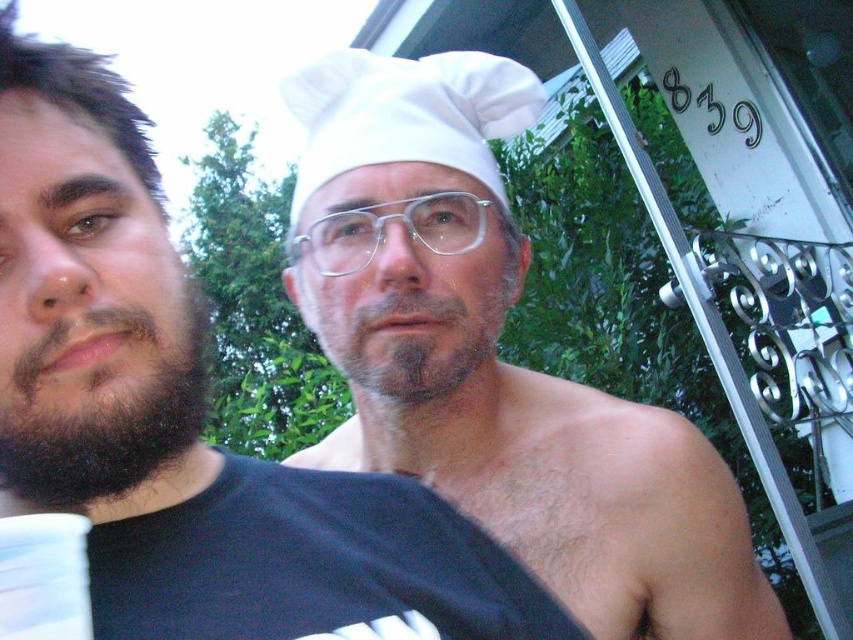
In the scene shown: You are a photographer trying to capture a closeup of the white matte chef hat at center and the white fabric chef hat at center. Which one will appear larger in your photo?

The white matte chef hat at center will appear larger in the photo because it is closer to the viewer than the white fabric chef hat at center.

You are a photographer trying to capture a portrait of both individuals in the scene. Since the white matte chef hat at center and the dark brown hair at left are close to each other, will the hat block the hair from being visible in the photo?

The white matte chef hat at center is positioned on the right side of dark brown hair at left, so the hat is to the right of the hair. Therefore, the hat will not block the visibility of the dark brown hair at left in the photo.

Looking at this image, you are standing in the residential area shown in the image. You need to locate the white matte chef hat at center. What are its coordinates?

The white matte chef hat at center is located at coordinates 0.650 on the x axis and 0.220 on the y axis.